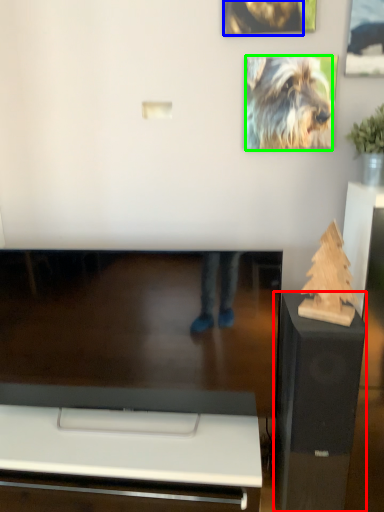
Question: Based on their relative distances, which object is nearer to furniture (highlighted by a red box)? Choose from dog (highlighted by a blue box) and dog (highlighted by a green box).

Choices:
 (A) dog
 (B) dog

Answer: (B)